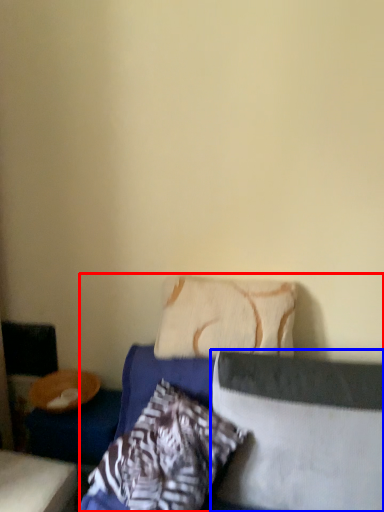
Question: Among these objects, which one is nearest to the camera, bed (highlighted by a red box) or pillow (highlighted by a blue box)?

Choices:
 (A) bed
 (B) pillow

Answer: (A)